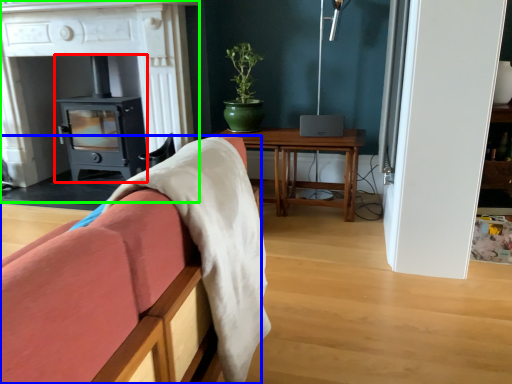
Question: Estimate the real-world distances between objects in this image. Which object is closer to wood burning stove (highlighted by a red box), furniture (highlighted by a blue box) or fireplace (highlighted by a green box)?

Choices:
 (A) furniture
 (B) fireplace

Answer: (B)